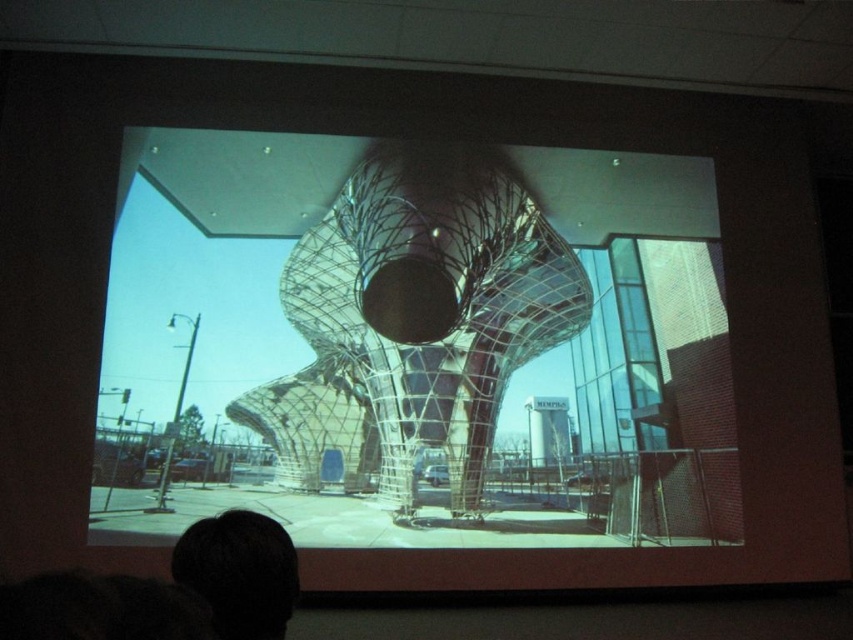
Between transparent glass sculpture at center and dark hair at lower left, which one has less height?

With less height is dark hair at lower left.

Which is more to the left, transparent glass sculpture at center or dark hair at lower left?

From the viewer's perspective, dark hair at lower left appears more on the left side.

Locate an element on the screen. The height and width of the screenshot is (640, 853). transparent glass sculpture at center is located at coordinates (415, 349).